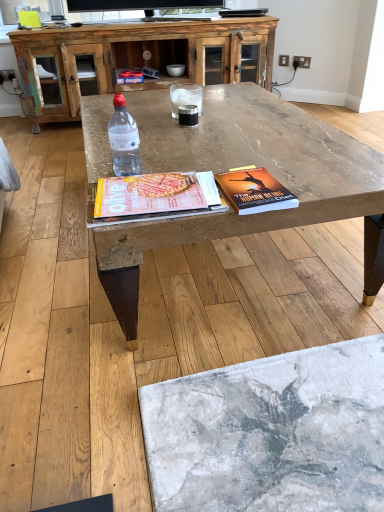
What do you see at coordinates (254, 191) in the screenshot?
I see `hardcover book at center` at bounding box center [254, 191].

The height and width of the screenshot is (512, 384). What do you see at coordinates (185, 97) in the screenshot? I see `clear glass at center` at bounding box center [185, 97].

Image resolution: width=384 pixels, height=512 pixels. I want to click on clear glass at center, so click(185, 97).

The image size is (384, 512). Describe the element at coordinates (155, 194) in the screenshot. I see `matte paper magazine at center` at that location.

What do you see at coordinates (236, 166) in the screenshot? I see `marble textured coffee table at center` at bounding box center [236, 166].

Identify the location of transparent plastic bottle at center. (124, 139).

Consider the image. From the image's perspective, is marble textured coffee table at center on top of rustic wood cabinet at upper center?

No, from the image's perspective, marble textured coffee table at center is not on top of rustic wood cabinet at upper center.

Considering the relative positions of marble textured coffee table at center and rustic wood cabinet at upper center in the image provided, is marble textured coffee table at center to the left of rustic wood cabinet at upper center from the viewer's perspective?

Incorrect, marble textured coffee table at center is not on the left side of rustic wood cabinet at upper center.

How different are the orientations of marble textured coffee table at center and rustic wood cabinet at upper center in degrees?

The angular difference between marble textured coffee table at center and rustic wood cabinet at upper center is 87.7 degrees.

Considering the relative sizes of marble textured coffee table at center and rustic wood cabinet at upper center in the image provided, is marble textured coffee table at center smaller than rustic wood cabinet at upper center?

No.

Is clear glass at center surrounded by rustic wood cabinet at upper center?

That's incorrect, clear glass at center is not inside rustic wood cabinet at upper center.

Can you tell me how much rustic wood cabinet at upper center and clear glass at center differ in facing direction?

They differ by 87.7 degrees in their facing directions.

Is the depth of rustic wood cabinet at upper center greater than that of clear glass at center?

Yes.

Based on the photo, is clear glass at center wider or thinner than transparent plastic bottle at center?

Clearly, clear glass at center has more width compared to transparent plastic bottle at center.

Is clear glass at center facing away from transparent plastic bottle at center?

No.

Who is smaller, clear glass at center or transparent plastic bottle at center?

With smaller size is transparent plastic bottle at center.

Which object is positioned more to the right, clear glass at center or transparent plastic bottle at center?

From the viewer's perspective, clear glass at center appears more on the right side.

Is there a large distance between black rubberized cup at center and rustic wood cabinet at upper center?

Yes, black rubberized cup at center and rustic wood cabinet at upper center are located far from each other.

Can you confirm if black rubberized cup at center is smaller than rustic wood cabinet at upper center?

Indeed, black rubberized cup at center has a smaller size compared to rustic wood cabinet at upper center.

Considering the sizes of black rubberized cup at center and rustic wood cabinet at upper center in the image, is black rubberized cup at center wider or thinner than rustic wood cabinet at upper center?

In the image, black rubberized cup at center appears to be more narrow than rustic wood cabinet at upper center.

Between point (186, 123) and point (202, 57), which one is positioned in front?

The point (186, 123) is more forward.

Is transparent plastic bottle at center further to camera compared to clear glass at center?

No, the depth of transparent plastic bottle at center is less than that of clear glass at center.

Is transparent plastic bottle at center taller or shorter than clear glass at center?

transparent plastic bottle at center is taller than clear glass at center.

Is transparent plastic bottle at center completely or partially outside of clear glass at center?

Yes, transparent plastic bottle at center is located beyond the bounds of clear glass at center.

Is clear glass at center at the back of transparent plastic bottle at center?

No, transparent plastic bottle at center is not facing the opposite direction of clear glass at center.

Between rustic wood cabinet at upper center and matte paper magazine at center, which one appears on the right side from the viewer's perspective?

Positioned to the right is matte paper magazine at center.

From a real-world perspective, is rustic wood cabinet at upper center under matte paper magazine at center?

A: Yes, from a real-world perspective, rustic wood cabinet at upper center is below matte paper magazine at center.

From the image's perspective, which one is positioned higher, rustic wood cabinet at upper center or matte paper magazine at center?

From the image's view, rustic wood cabinet at upper center is above.

Is rustic wood cabinet at upper center located outside matte paper magazine at center?

Yes, rustic wood cabinet at upper center is outside of matte paper magazine at center.

Can you confirm if hardcover book at center is bigger than rustic wood cabinet at upper center?

Actually, hardcover book at center might be smaller than rustic wood cabinet at upper center.

Choose the correct answer: Is hardcover book at center inside rustic wood cabinet at upper center or outside it?

hardcover book at center is located beyond the bounds of rustic wood cabinet at upper center.

Does hardcover book at center have a lesser width compared to rustic wood cabinet at upper center?

Correct, the width of hardcover book at center is less than that of rustic wood cabinet at upper center.

The height and width of the screenshot is (512, 384). Identify the location of coffee table in front of the rustic wood cabinet at upper center. (236, 166).

Where is `cabinetry that is under the clear glass at center (from a real-world perspective)`? This screenshot has height=512, width=384. cabinetry that is under the clear glass at center (from a real-world perspective) is located at coordinates (141, 56).

When comparing their distances from clear glass at center, does marble textured coffee table at center or black rubberized cup at center seem further?

Among the two, marble textured coffee table at center is located further to clear glass at center.

When comparing their distances from clear glass at center, does marble textured coffee table at center or rustic wood cabinet at upper center seem further?

rustic wood cabinet at upper center is further to clear glass at center.

Which object lies nearer to the anchor point hardcover book at center, black rubberized cup at center or matte paper magazine at center?

Based on the image, matte paper magazine at center appears to be nearer to hardcover book at center.

Which object lies further to the anchor point transparent plastic bottle at center, marble textured coffee table at center or rustic wood cabinet at upper center?

rustic wood cabinet at upper center lies further to transparent plastic bottle at center than the other object.

Which object lies further to the anchor point matte paper magazine at center, marble textured coffee table at center or hardcover book at center?

marble textured coffee table at center is further to matte paper magazine at center.

From the image, which object appears to be nearer to matte paper magazine at center, transparent plastic bottle at center or marble textured coffee table at center?

transparent plastic bottle at center lies closer to matte paper magazine at center than the other object.

Looking at the image, which one is located further to clear glass at center, black rubberized cup at center or matte paper magazine at center?

matte paper magazine at center is further to clear glass at center.

When comparing their distances from hardcover book at center, does black rubberized cup at center or rustic wood cabinet at upper center seem further?

rustic wood cabinet at upper center is further to hardcover book at center.

This screenshot has width=384, height=512. I want to click on bottle between marble textured coffee table at center and clear glass at center along the z-axis, so click(x=124, y=139).

In order to click on paperback book located between matte paper magazine at center and black rubberized cup at center in the depth direction in this screenshot , I will do pos(254,191).

The height and width of the screenshot is (512, 384). What are the coordinates of `water between marble textured coffee table at center and rustic wood cabinet at upper center in the front-back direction` in the screenshot? It's located at 185,97.

The height and width of the screenshot is (512, 384). I want to click on magazine between transparent plastic bottle at center and marble textured coffee table at center from left to right, so click(x=155, y=194).